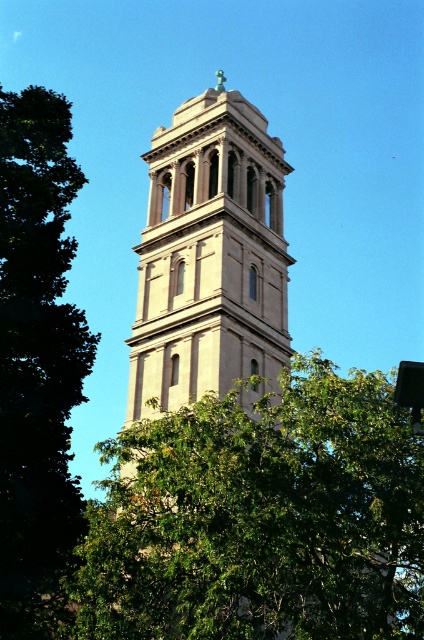
You are standing in a park and see the green leafy tree at center and the beige stone tower at center. Which object is positioned to the right of the other?

The green leafy tree at center is positioned to the right of the beige stone tower at center.

You are standing at the base of the bell tower and want to take a photo of the green leafy tree at center without any obstructions. Since the tree is partially hidden by the tower, can you move to the left or right to get a clear view?

The green leafy tree at center is located at point (261, 518). Since coordinates are relative to the image, moving to the right would allow you to see the tree without obstruction from the tower.